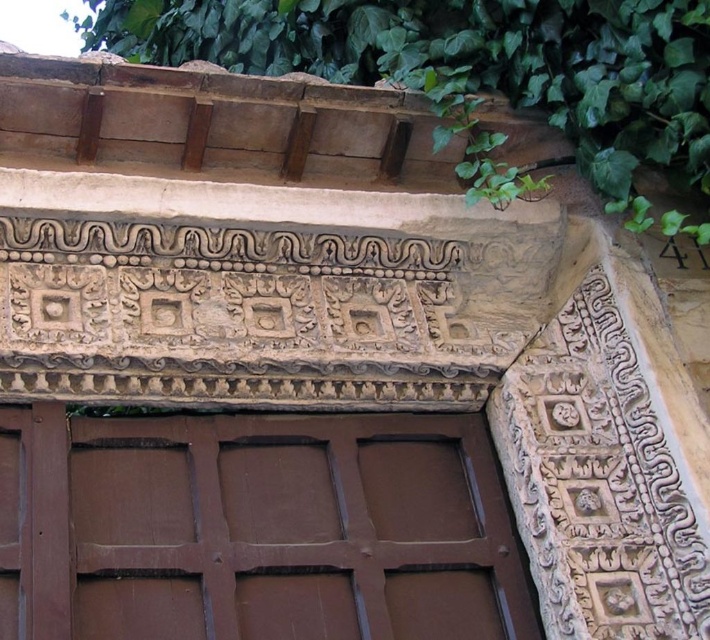
Does point (344, 492) come farther from viewer compared to point (537, 22)?

No.

Which is behind, point (513, 570) or point (497, 186)?

Positioned behind is point (497, 186).

You are a GUI agent. You are given a task and a screenshot of the screen. Output one action in this format:
    pyautogui.click(x=<x>, y=<y>)
    Task: Click on the brown wooden door at center
    Image resolution: width=710 pixels, height=640 pixels.
    Given the screenshot: What is the action you would take?
    pyautogui.click(x=256, y=529)